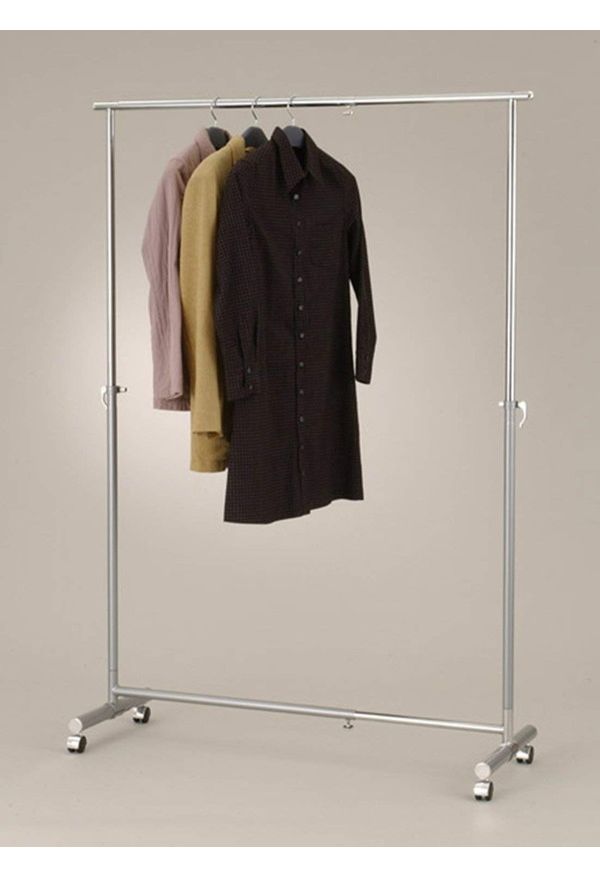
Identify the location of clothes and hangers. 300,251, 294,134, 252,136, 204,198, 216,136, 172,191.